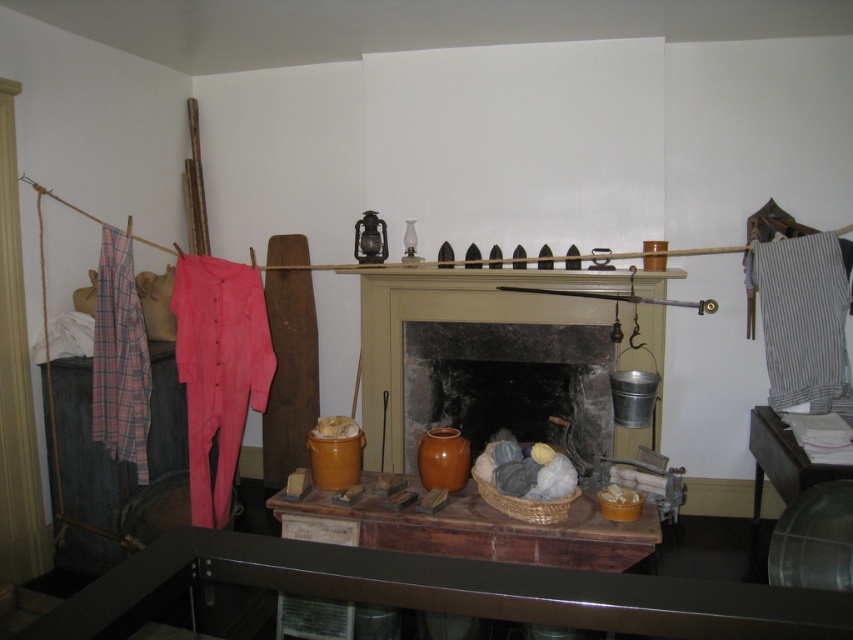
You are organizing a historical exhibit and need to place the plaid cotton pants at left and the white paper at lower right on a display board. Which object should you place first if you want to arrange them from smallest to largest?

The plaid cotton pants at left is smaller than the white paper at lower right, so you should place the plaid cotton pants at left first when arranging from smallest to largest.

You are standing in the room and want to pick up the plaid cotton pants at left and the white paper at lower right. Which item will you need to reach for first?

The plaid cotton pants at left is further to the viewer than the white paper at lower right, so you will need to reach for the plaid cotton pants at left first.

You are standing in the rustic interior scene described. You need to place a new decorative item on the mantel of the central fireplace. However, you must ensure that this new item does not overlap with the plaid cotton pants at left. Given their current position at coordinates approximately 0.558 on the x and 0.141 on the y axis, where should you place the new item to avoid overlapping?

The plaid cotton pants at left are located at coordinates approximately 0.558 on the x and 0.141 on the y axis. To avoid overlapping, place the new item away from these coordinates, either to the left or right along the mantel or at a different height on the mantel.